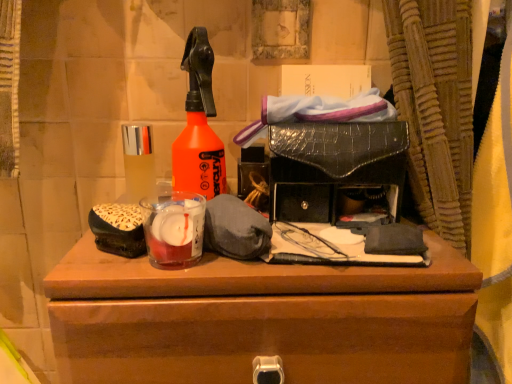
Find the location of a particular element. The width and height of the screenshot is (512, 384). unoccupied region to the right of translucent glass candle at center is located at coordinates (311, 269).